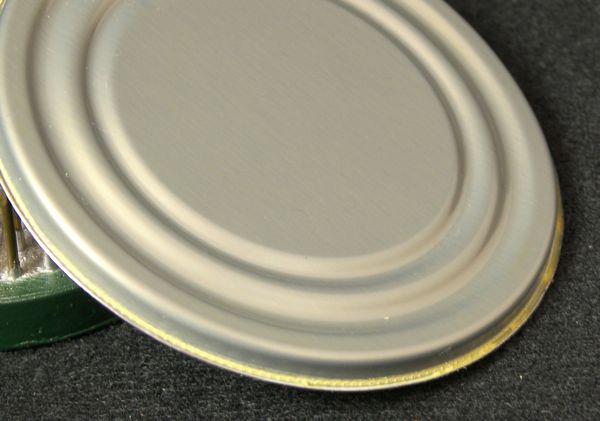
The image size is (600, 421). Find the location of `surface`. surface is located at coordinates (149, 393).